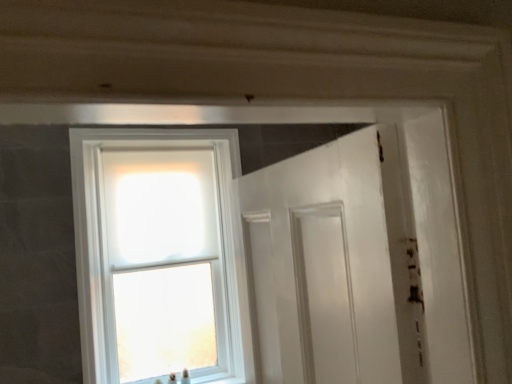
Where is `clear glass window at upper left`? The height and width of the screenshot is (384, 512). clear glass window at upper left is located at coordinates (156, 254).

Measure the distance between clear glass window at upper left and camera.

clear glass window at upper left is 7.92 feet away from camera.

Describe the element at coordinates (156, 254) in the screenshot. I see `clear glass window at upper left` at that location.

I want to click on white glossy door at center, so click(324, 294).

In order to face white glossy door at center, should I rotate leftwards or rightwards?

You should rotate right by 8.048 degrees.

What is the approximate width of white glossy door at center?

white glossy door at center is 3.27 inches in width.

What do you see at coordinates (324, 294) in the screenshot? Image resolution: width=512 pixels, height=384 pixels. I see `white glossy door at center` at bounding box center [324, 294].

Where is `clear glass window at upper left`? This screenshot has height=384, width=512. clear glass window at upper left is located at coordinates (156, 254).

Is white glossy door at center to the right of clear glass window at upper left from the viewer's perspective?

Yes.

Is white glossy door at center in front of clear glass window at upper left?

No, it is not.

Which point is more forward, (326,301) or (169,287)?

Point (326,301)

From the image's perspective, is white glossy door at center under clear glass window at upper left?

Indeed, from the image's perspective, white glossy door at center is shown beneath clear glass window at upper left.

From a real-world perspective, which is physically below, white glossy door at center or clear glass window at upper left?

From a 3D spatial view, white glossy door at center is below.

Is white glossy door at center wider than clear glass window at upper left?

Incorrect, the width of white glossy door at center does not surpass that of clear glass window at upper left.

Between white glossy door at center and clear glass window at upper left, which one has less height?

white glossy door at center.

Which of these two, white glossy door at center or clear glass window at upper left, is bigger?

With larger size is clear glass window at upper left.

Is white glossy door at center outside of clear glass window at upper left?

Absolutely, white glossy door at center is external to clear glass window at upper left.

Is white glossy door at center next to clear glass window at upper left and touching it?

white glossy door at center and clear glass window at upper left are clearly separated.

Is white glossy door at center turned away from clear glass window at upper left?

No, clear glass window at upper left is not at the back of white glossy door at center.

Where is `window above the white glossy door at center (from a real-world perspective)`? Image resolution: width=512 pixels, height=384 pixels. window above the white glossy door at center (from a real-world perspective) is located at coordinates (156, 254).

Is clear glass window at upper left to the left or to the right of white glossy door at center in the image?

clear glass window at upper left is to the left of white glossy door at center.

Is clear glass window at upper left in front of or behind white glossy door at center in the image?

Clearly, clear glass window at upper left is in front of white glossy door at center.

Considering the points (80, 151) and (292, 232), which point is in front, point (80, 151) or point (292, 232)?

Point (292, 232)

From the image's perspective, between clear glass window at upper left and white glossy door at center, which one is located above?

clear glass window at upper left, from the image's perspective.

From a real-world perspective, is clear glass window at upper left on top of white glossy door at center?

Yes.

Considering the relative sizes of clear glass window at upper left and white glossy door at center in the image provided, is clear glass window at upper left wider than white glossy door at center?

Yes.

Which of these two, clear glass window at upper left or white glossy door at center, stands shorter?

With less height is white glossy door at center.

Does clear glass window at upper left have a larger size compared to white glossy door at center?

Yes, clear glass window at upper left is bigger than white glossy door at center.

Is white glossy door at center a part of clear glass window at upper left?

Actually, white glossy door at center is outside clear glass window at upper left.

Is there a large distance between clear glass window at upper left and white glossy door at center?

Yes, clear glass window at upper left is far from white glossy door at center.

Could you tell me if clear glass window at upper left is facing white glossy door at center?

No, clear glass window at upper left is not turned towards white glossy door at center.

From the picture: How different are the orientations of clear glass window at upper left and white glossy door at center in degrees?

clear glass window at upper left and white glossy door at center are facing 0.0775 degrees away from each other.

Identify the location of screen door on the right of clear glass window at upper left. (324, 294).

Where is `screen door behind the clear glass window at upper left`? screen door behind the clear glass window at upper left is located at coordinates (324, 294).

I want to click on screen door below the clear glass window at upper left (from the image's perspective), so click(324, 294).